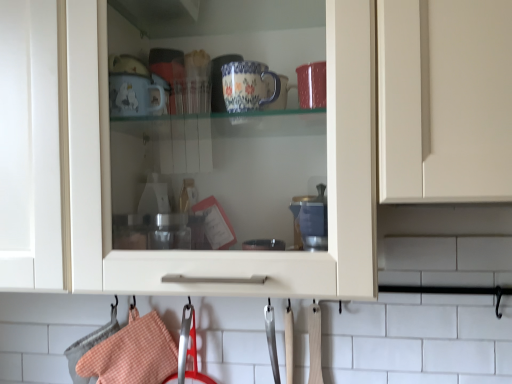
You are a GUI agent. You are given a task and a screenshot of the screen. Output one action in this format:
    pyautogui.click(x=<x>, y=<y>)
    Task: Click on the vacant space situated above pink checkered oven mitt at lower left (from a real-world perspective)
    This screenshot has width=512, height=384.
    Given the screenshot: What is the action you would take?
    pyautogui.click(x=116, y=311)